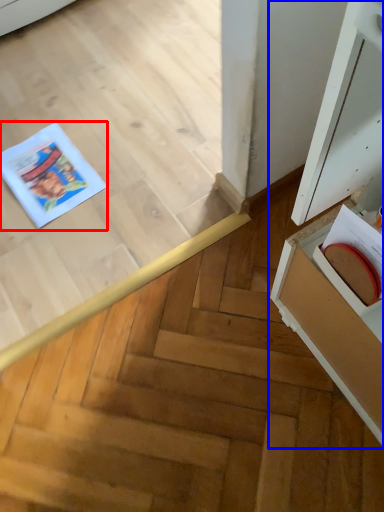
Question: Which point is closer to the camera, comic book (highlighted by a red box) or cabinetry (highlighted by a blue box)?

Choices:
 (A) comic book
 (B) cabinetry

Answer: (B)